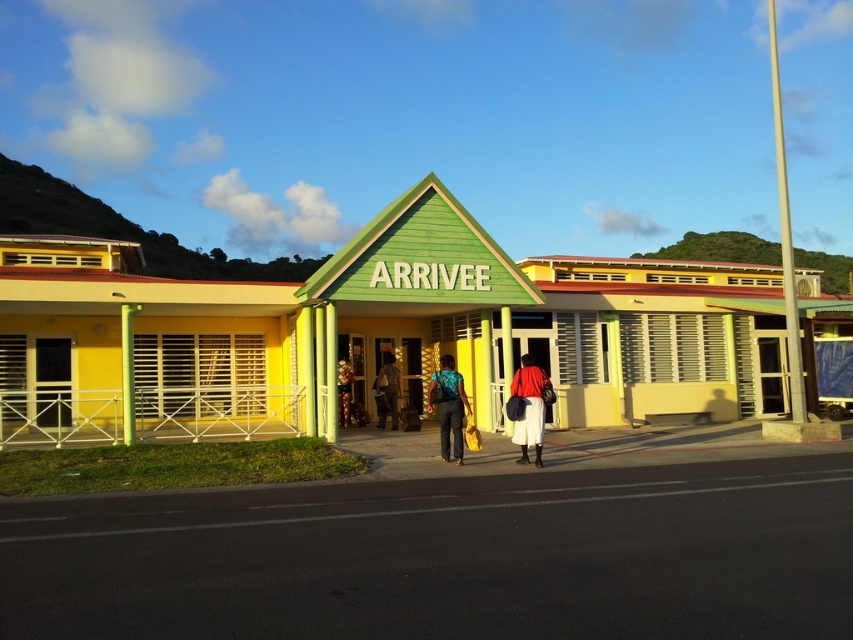
Question: Which of the following is the farthest from the observer?

Choices:
 (A) teal fabric backpack at center
 (B) red matte skirt at center

Answer: (A)

Question: Among these objects, which one is nearest to the camera?

Choices:
 (A) teal fabric backpack at center
 (B) red matte skirt at center

Answer: (B)

Question: Can you confirm if teal fabric backpack at center is positioned to the right of red matte skirt at center?

Choices:
 (A) no
 (B) yes

Answer: (A)

Question: Does teal fabric backpack at center lie behind red matte skirt at center?

Choices:
 (A) no
 (B) yes

Answer: (B)

Question: Does teal fabric backpack at center come in front of red matte skirt at center?

Choices:
 (A) yes
 (B) no

Answer: (B)